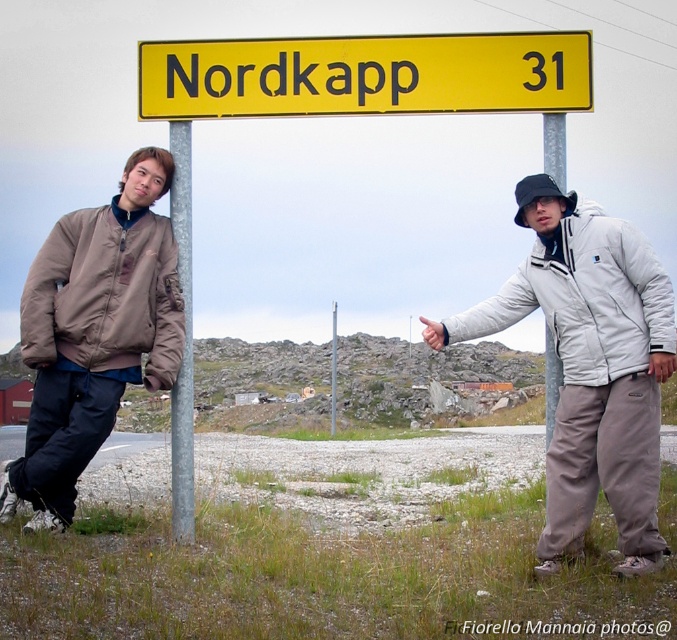
Question: Does brushed metal pole at upper center appear under metallic pole at center?

Choices:
 (A) no
 (B) yes

Answer: (B)

Question: Can you confirm if matte brown bomber jacket at left is positioned above metallic pole at center?

Choices:
 (A) no
 (B) yes

Answer: (B)

Question: Which object appears farthest from the camera in this image?

Choices:
 (A) silver metallic pole at left
 (B) yellow plastic sign at upper center
 (C) metallic pole at center
 (D) matte brown bomber jacket at left

Answer: (C)

Question: Which point is farther from the camera taking this photo?

Choices:
 (A) click(x=244, y=49)
 (B) click(x=546, y=368)
 (C) click(x=330, y=422)
 (D) click(x=179, y=138)

Answer: (C)

Question: Can you confirm if brushed metal pole at upper center is positioned above metallic pole at center?

Choices:
 (A) no
 (B) yes

Answer: (A)

Question: Which point is closer to the camera?

Choices:
 (A) (332, 362)
 (B) (177, 131)
 (C) (72, 490)
 (D) (544, 172)

Answer: (D)